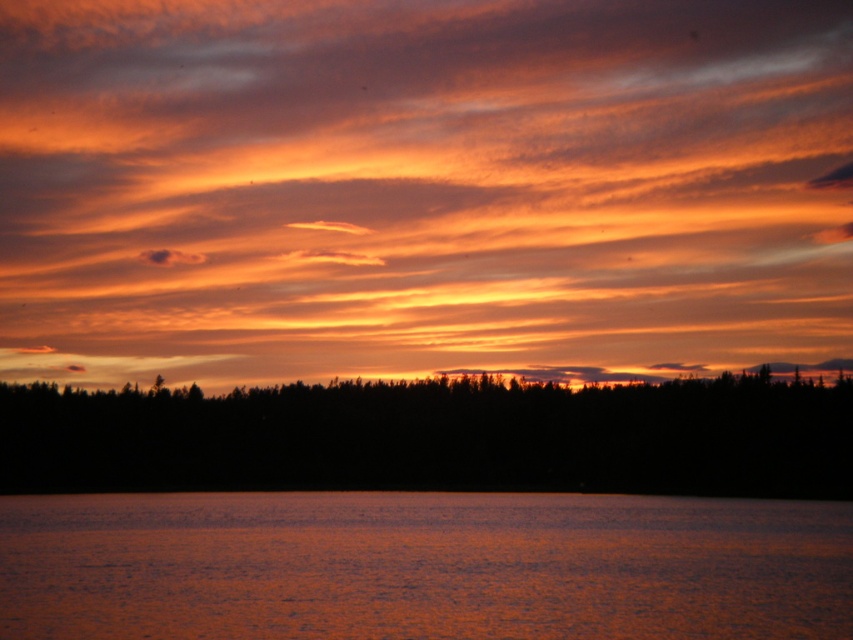
From the picture: You are standing at the lakeside and looking at the sunset. You see the orange matte cloud at upper center and the black silhouette trees at bottom. Which object is closer to your eyes?

The orange matte cloud at upper center is closer to your eyes than the black silhouette trees at bottom because it is further to the viewer.

You are an artist trying to paint the sunset scene. You need to decide which area to paint first based on their sizes. Since you want to start with the larger one, which object should you choose between the orange matte cloud at upper center and the orange reflective water at bottom?

The orange matte cloud at upper center might be wider than orange reflective water at bottom, so you should start painting the orange matte cloud at upper center first.

Consider the image. You are standing on a dock looking at the sunset scene. Which object, the orange reflective water at bottom or the black silhouette trees at bottom, is nearer to you?

The orange reflective water at bottom is closer to you than the black silhouette trees at bottom.